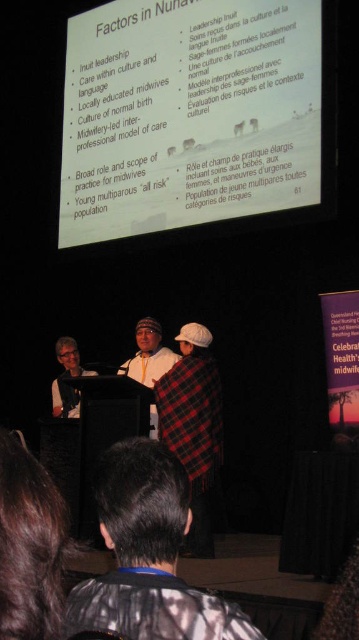
You are standing at the point labeled point (180,184). If you walk straight towards the projection screen, will you reach it before covering 50 feet?

The distance between you and the projection screen is 46.93 feet, so yes, you will reach it before covering 50 feet.

You are an attendee at the presentation. You want to take a photo of the slide on the white matte projector screen at upper center but also want to include the plaid fabric blanket at center in the frame. Can you fit both in your camera viewfinder without moving your position?

The white matte projector screen at upper center is much taller than the plaid fabric blanket at center, so you can fit both in your camera viewfinder by adjusting the zoom or framing to include both the taller screen and the blanket.

You are setting up a presentation and need to ensure that the white matte projector screen at upper center and the plaid fabric blanket at center are visible to the audience. Given their sizes, which object should be placed closer to the front to ensure clarity?

The plaid fabric blanket at center should be placed closer to the front since it is smaller in width compared to the white matte projector screen at upper center, ensuring its details are clearly visible to the audience.